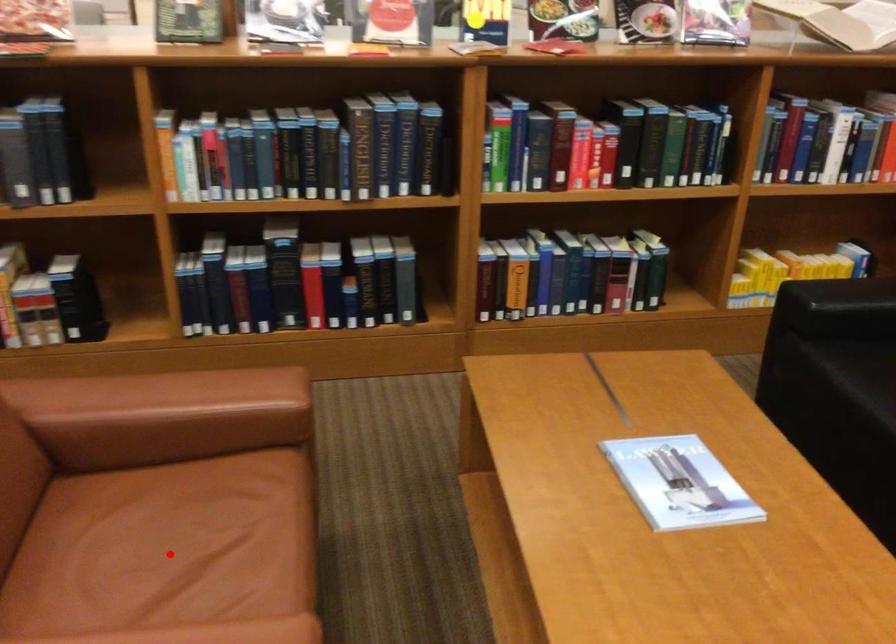
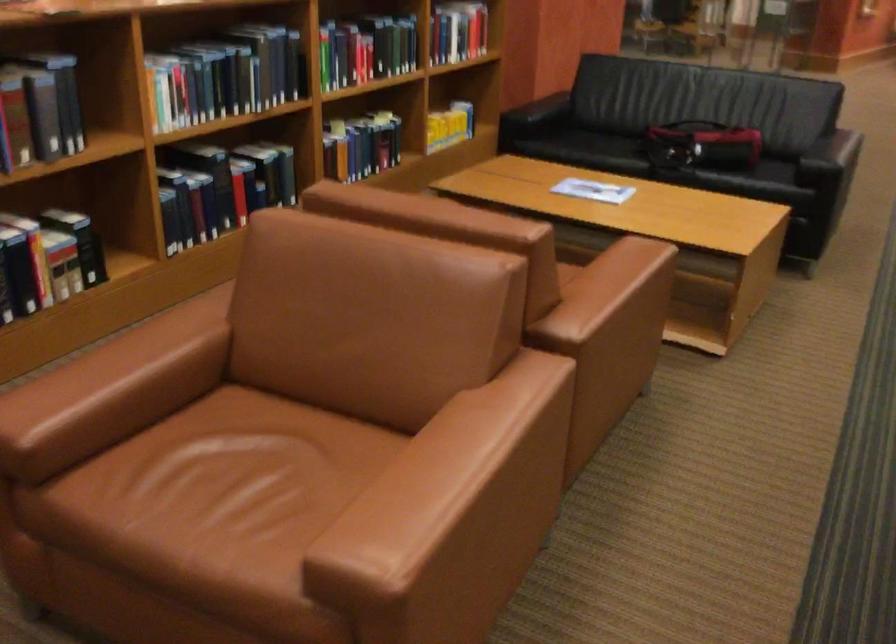
Question: I am providing you with two images of the same scene from different viewpoints. A red point is marked on the first image. At the location where the point appears in image 1, is it still visible in image 2?

Choices:
 (A) Yes
 (B) No

Answer: (B)